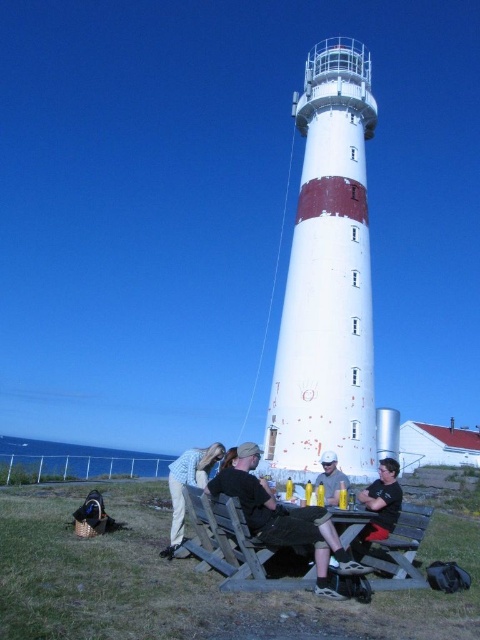
You are a photographer standing at the lower right of the image. You want to take a photo of the matte black shirt at lower center without the wooden park bench at lower right blocking the view. Is the bench too tall to block the shirt?

The wooden park bench at lower right is not as tall as the matte black shirt at lower center, so the bench will not block the view of the shirt.